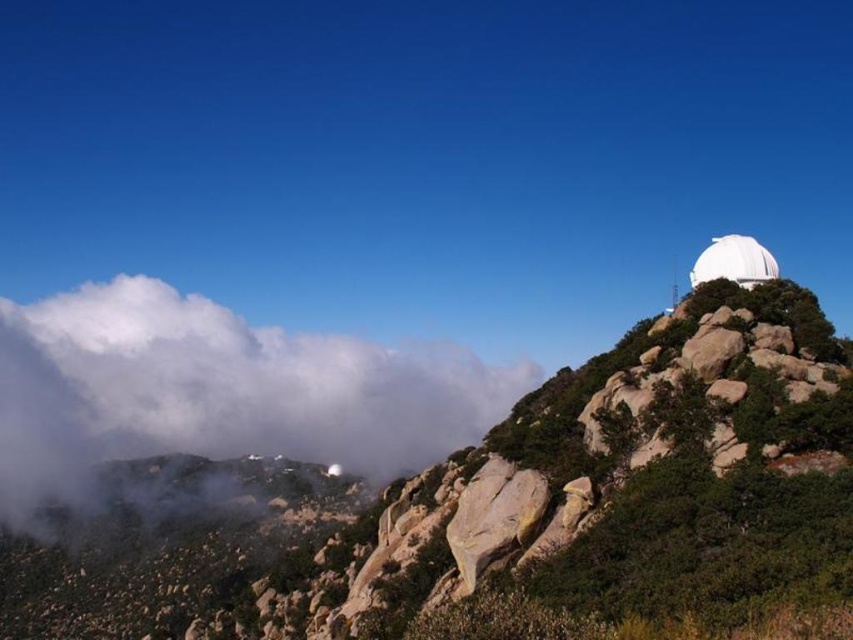
In the scene shown: You are a photographer standing at the base of the smooth granite mountain at upper right. You want to capture a closeup shot of its surface. Considering your camera can focus on objects within 50 meters, will you be able to take the photo without moving closer?

The smooth granite mountain at upper right is 47.38 meters away from the camera. Since this distance is within the 50 meters focusing range, you can take the closeup shot without moving closer.

Based on the photo, you are a hiker standing at the base of the mountain looking up. You notice a white fluffy cloud at upper left marked by point (218, 390). Can you see the entire cloud from your current position?

The point (218, 390) marks the white fluffy cloud at upper left, so yes, you can see the entire cloud from your current position as it is marked at that specific coordinate.